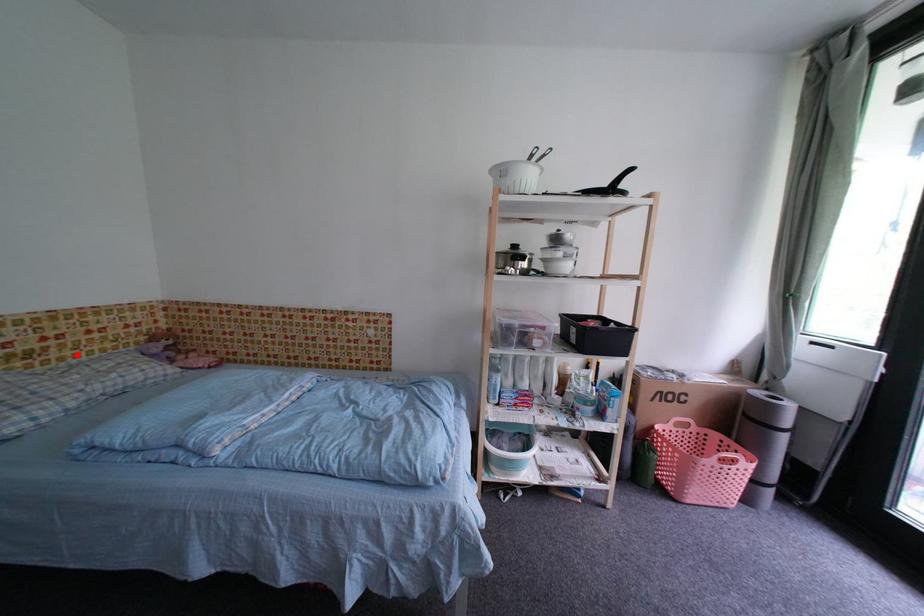
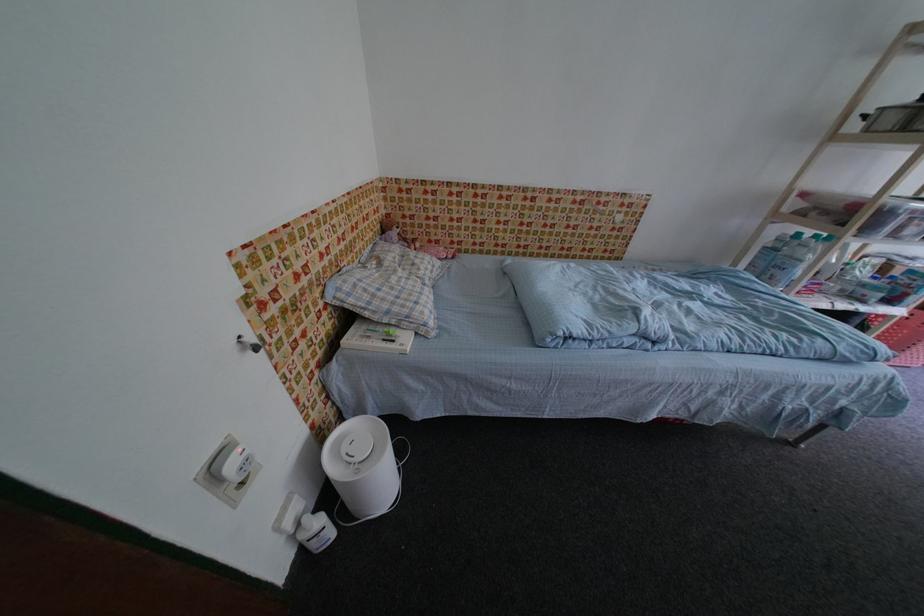
Where in the second image is the point corresponding to the highlighted location from the first image?

(370, 246)